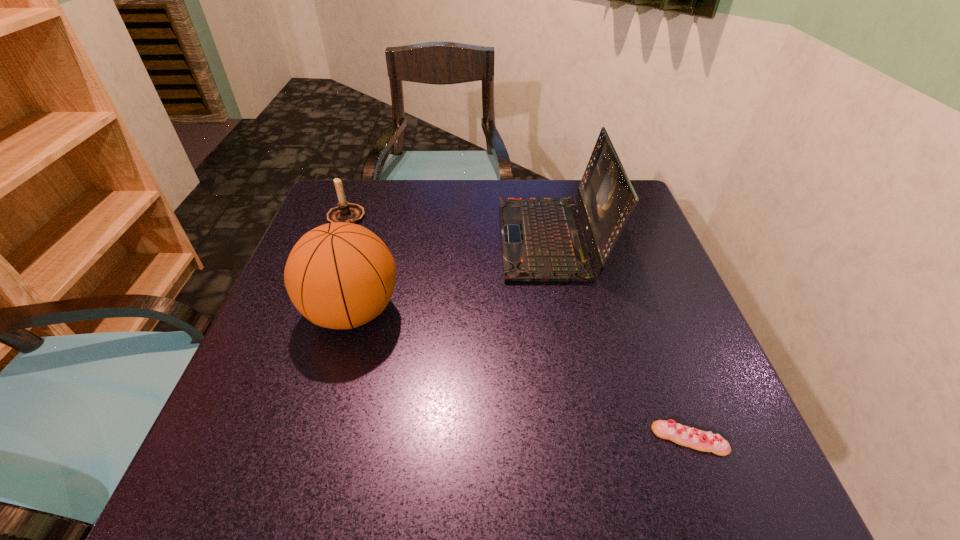
Identify the location of object that is at the near right corner. (680, 434).

Locate an element on the screen. The image size is (960, 540). free spot at the far edge of the desktop is located at coordinates (481, 179).

At what (x,y) coordinates should I click in order to perform the action: click on vacant space at the near edge of the desktop. Please return your answer as a coordinate pair (x, y). This screenshot has height=540, width=960. Looking at the image, I should click on (525, 457).

In the image, there is a desktop. Where is `vacant space at the left edge`? This screenshot has height=540, width=960. vacant space at the left edge is located at coordinates (315, 427).

The width and height of the screenshot is (960, 540). Find the location of `free space at the right edge of the desktop`. free space at the right edge of the desktop is located at coordinates (671, 336).

Identify the location of vacant point at the far left corner. The width and height of the screenshot is (960, 540). (360, 186).

Find the location of a particular element. vacant space at the near left corner is located at coordinates (300, 475).

Locate an element on the screen. The width and height of the screenshot is (960, 540). vacant region at the near right corner of the desktop is located at coordinates (753, 454).

The image size is (960, 540). I want to click on free space between the candle holder and the laptop computer, so click(448, 228).

Identify the location of vacant region between the basketball and the laptop computer. (452, 275).